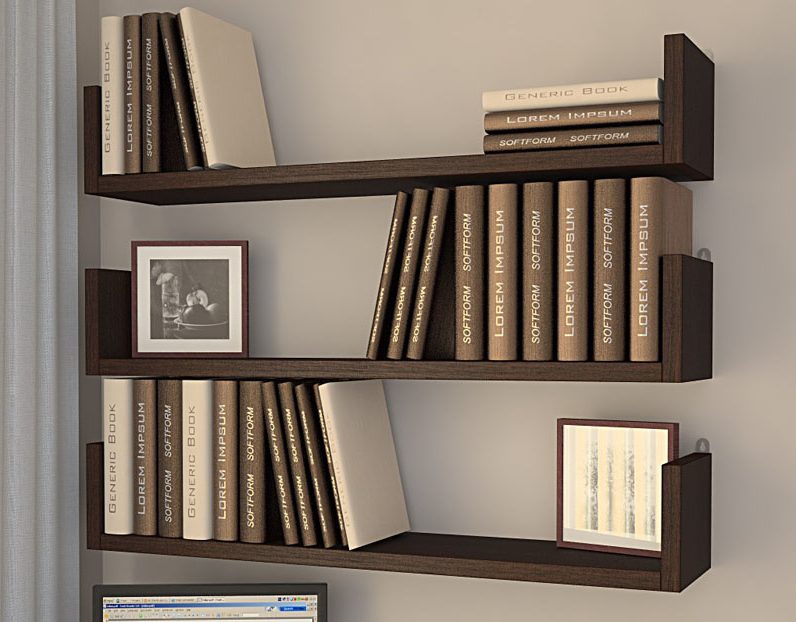
You are a GUI agent. You are given a task and a screenshot of the screen. Output one action in this format:
    pyautogui.click(x=<x>, y=<y>)
    Task: Click on the book on middle shelf
    
    Given the screenshot: What is the action you would take?
    pyautogui.click(x=380, y=307), pyautogui.click(x=398, y=327), pyautogui.click(x=422, y=315), pyautogui.click(x=466, y=328), pyautogui.click(x=509, y=318), pyautogui.click(x=539, y=323), pyautogui.click(x=576, y=321), pyautogui.click(x=617, y=320), pyautogui.click(x=648, y=320)